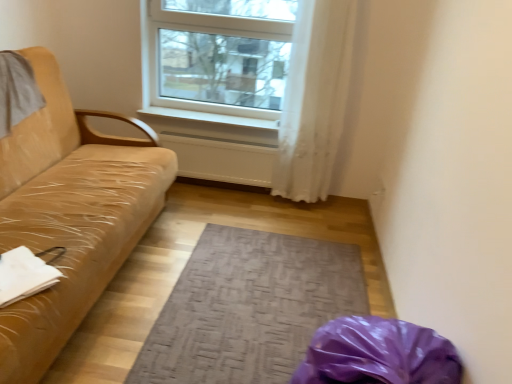
Question: Does tan leather couch at left have a greater height compared to white sheer curtain at upper center?

Choices:
 (A) no
 (B) yes

Answer: (A)

Question: Considering the relative sizes of tan leather couch at left and white sheer curtain at upper center in the image provided, is tan leather couch at left shorter than white sheer curtain at upper center?

Choices:
 (A) yes
 (B) no

Answer: (A)

Question: Is tan leather couch at left at the right side of white sheer curtain at upper center?

Choices:
 (A) yes
 (B) no

Answer: (B)

Question: From a real-world perspective, is tan leather couch at left located higher than white sheer curtain at upper center?

Choices:
 (A) no
 (B) yes

Answer: (A)

Question: Does tan leather couch at left have a smaller size compared to white sheer curtain at upper center?

Choices:
 (A) no
 (B) yes

Answer: (A)

Question: Is tan leather couch at left facing towards white sheer curtain at upper center?

Choices:
 (A) yes
 (B) no

Answer: (A)

Question: Considering the relative positions of white smooth window sill at center and tan leather couch at left in the image provided, is white smooth window sill at center to the left of tan leather couch at left from the viewer's perspective?

Choices:
 (A) yes
 (B) no

Answer: (B)

Question: Is white smooth window sill at center placed right next to tan leather couch at left?

Choices:
 (A) yes
 (B) no

Answer: (B)

Question: From a real-world perspective, does white smooth window sill at center stand above tan leather couch at left?

Choices:
 (A) yes
 (B) no

Answer: (A)

Question: Considering the relative sizes of white smooth window sill at center and tan leather couch at left in the image provided, is white smooth window sill at center smaller than tan leather couch at left?

Choices:
 (A) yes
 (B) no

Answer: (A)

Question: Considering the relative sizes of white smooth window sill at center and tan leather couch at left in the image provided, is white smooth window sill at center thinner than tan leather couch at left?

Choices:
 (A) no
 (B) yes

Answer: (B)

Question: Is white smooth window sill at center outside of tan leather couch at left?

Choices:
 (A) no
 (B) yes

Answer: (B)

Question: Is textured gray mat at center at the back of white smooth window sill at center?

Choices:
 (A) yes
 (B) no

Answer: (B)